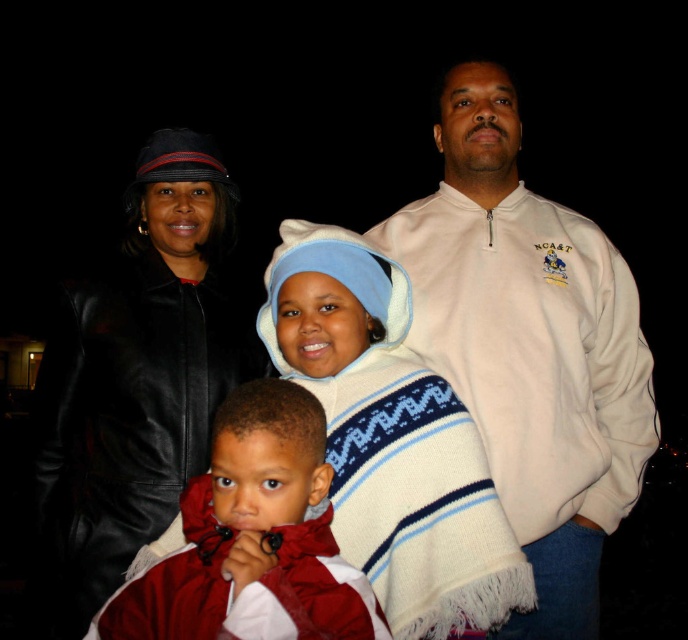
Between black leather jacket at upper left and red fleece jacket at center, which one appears on the left side from the viewer's perspective?

From the viewer's perspective, black leather jacket at upper left appears more on the left side.

Does black leather jacket at upper left lie behind red fleece jacket at center?

Yes.

Which is behind, point (172, 188) or point (214, 600)?

Positioned behind is point (172, 188).

Where is `black leather jacket at upper left`? This screenshot has width=688, height=640. black leather jacket at upper left is located at coordinates (136, 378).

What do you see at coordinates (528, 346) in the screenshot? The width and height of the screenshot is (688, 640). I see `white fleece jacket at upper right` at bounding box center [528, 346].

Is white fleece jacket at upper right smaller than white knitted sweater at center?

No.

Describe the element at coordinates (528, 346) in the screenshot. I see `white fleece jacket at upper right` at that location.

Image resolution: width=688 pixels, height=640 pixels. Identify the location of white fleece jacket at upper right. (528, 346).

Between point (363, 570) and point (224, 602), which one is positioned behind?

Positioned behind is point (363, 570).

Is white knitted sweater at center to the right of red fleece jacket at center from the viewer's perspective?

Correct, you'll find white knitted sweater at center to the right of red fleece jacket at center.

Which is behind, point (440, 403) or point (297, 388)?

The point (440, 403) is more distant.

In order to click on white knitted sweater at center in this screenshot , I will do `click(391, 438)`.